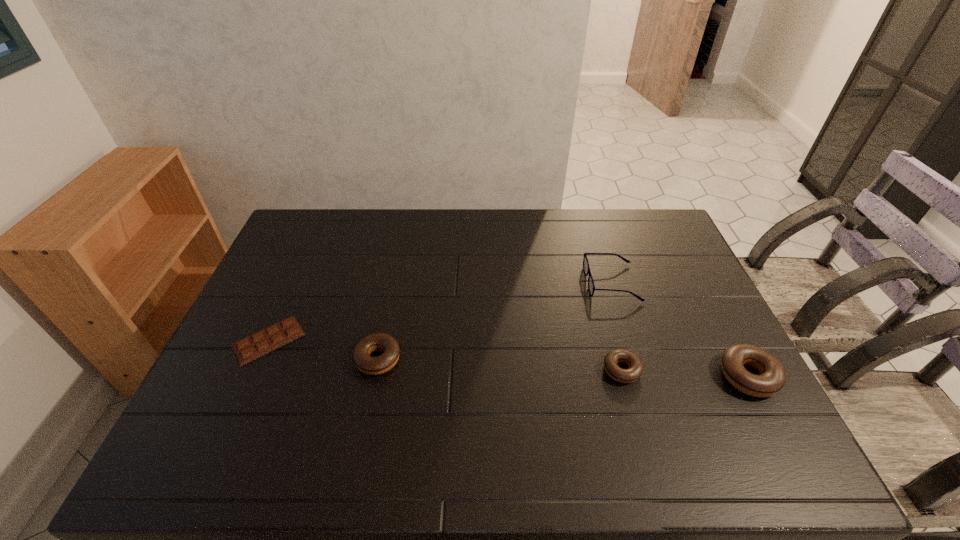
You are a GUI agent. You are given a task and a screenshot of the screen. Output one action in this format:
    pyautogui.click(x=<x>, y=<y>)
    Task: Click on the free space at the far edge
    
    Given the screenshot: What is the action you would take?
    pyautogui.click(x=510, y=219)

In the image, there is a desktop. What are the coordinates of `vacant area at the near edge` in the screenshot? It's located at (281, 399).

Where is `free location at the left edge of the desktop`? The height and width of the screenshot is (540, 960). free location at the left edge of the desktop is located at coordinates pyautogui.click(x=227, y=379).

The width and height of the screenshot is (960, 540). In the image, there is a desktop. Identify the location of vacant space at the right edge. (701, 292).

Locate an element on the screen. vacant space at the near left corner of the desktop is located at coordinates (215, 409).

Image resolution: width=960 pixels, height=540 pixels. In the image, there is a desktop. Identify the location of vacant space at the near right corner. (767, 423).

Locate an element on the screen. This screenshot has height=540, width=960. vacant space that's between the third shortest object and the tallest doughnut is located at coordinates (563, 367).

In order to click on free space between the tallest doughnut and the chocolate bar in this screenshot , I will do `click(508, 358)`.

Image resolution: width=960 pixels, height=540 pixels. Find the location of `vacant area that lies between the leftmost object and the second shortest doughnut`. vacant area that lies between the leftmost object and the second shortest doughnut is located at coordinates (324, 349).

Find the location of `free space between the rightmost doughnut and the second doughnut from left to right`. free space between the rightmost doughnut and the second doughnut from left to right is located at coordinates (684, 373).